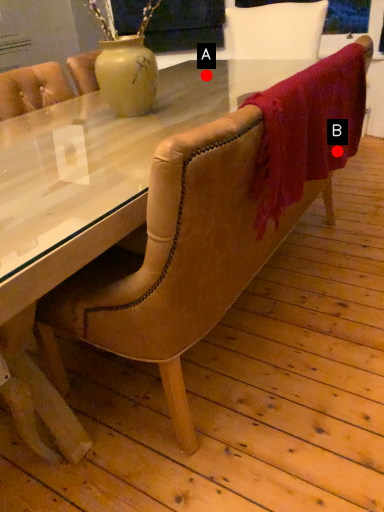
Question: Two points are circled on the image, labeled by A and B beside each circle. Which of the following is the closest to the observer?

Choices:
 (A) A is closer
 (B) B is closer

Answer: (B)